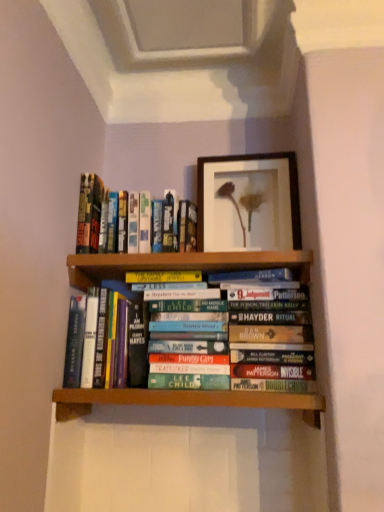
Question: Can you confirm if wooden framed picture at upper center is smaller than hardcover book at center, the first book when ordered from bottom to top?

Choices:
 (A) no
 (B) yes

Answer: (B)

Question: Can you confirm if wooden framed picture at upper center is shorter than hardcover book at center, the first book when ordered from bottom to top?

Choices:
 (A) no
 (B) yes

Answer: (A)

Question: Is wooden framed picture at upper center facing away from hardcover book at center, the first book when ordered from bottom to top?

Choices:
 (A) no
 (B) yes

Answer: (A)

Question: Can you confirm if wooden framed picture at upper center is taller than hardcover book at center, the first book when ordered from bottom to top?

Choices:
 (A) no
 (B) yes

Answer: (B)

Question: Is wooden framed picture at upper center oriented towards hardcover book at center, the first book when ordered from bottom to top?

Choices:
 (A) no
 (B) yes

Answer: (A)

Question: Looking at their shapes, would you say wooden framed picture at upper center is wider or thinner than hardcover books at upper left, the 1th book viewed from the top?

Choices:
 (A) thin
 (B) wide

Answer: (A)

Question: From a real-world perspective, is wooden framed picture at upper center physically located above or below hardcover books at upper left, the second book positioned from the bottom?

Choices:
 (A) above
 (B) below

Answer: (A)

Question: Is wooden framed picture at upper center in front of or behind hardcover books at upper left, the second book positioned from the bottom, in the image?

Choices:
 (A) behind
 (B) front

Answer: (A)

Question: From their relative heights in the image, would you say wooden framed picture at upper center is taller or shorter than hardcover books at upper left, the 1th book viewed from the top?

Choices:
 (A) short
 (B) tall

Answer: (B)

Question: In terms of height, does hardcover books at upper left, the 1th book viewed from the top, look taller or shorter compared to hardcover book at center, the first book when ordered from bottom to top?

Choices:
 (A) short
 (B) tall

Answer: (A)

Question: Is hardcover books at upper left, the 1th book viewed from the top, bigger or smaller than hardcover book at center, positioned as the 2th book in top-to-bottom order?

Choices:
 (A) small
 (B) big

Answer: (B)

Question: Relative to hardcover book at center, the first book when ordered from bottom to top, is hardcover books at upper left, the second book positioned from the bottom, in front or behind?

Choices:
 (A) behind
 (B) front

Answer: (A)

Question: From a real-world perspective, relative to hardcover book at center, positioned as the 2th book in top-to-bottom order, is hardcover books at upper left, the 1th book viewed from the top, vertically above or below?

Choices:
 (A) above
 (B) below

Answer: (A)

Question: Considering their positions, is hardcover book at center, positioned as the 2th book in top-to-bottom order, located in front of or behind wooden framed picture at upper center?

Choices:
 (A) front
 (B) behind

Answer: (A)

Question: Would you say hardcover book at center, the first book when ordered from bottom to top, is to the left or to the right of wooden framed picture at upper center in the picture?

Choices:
 (A) left
 (B) right

Answer: (A)